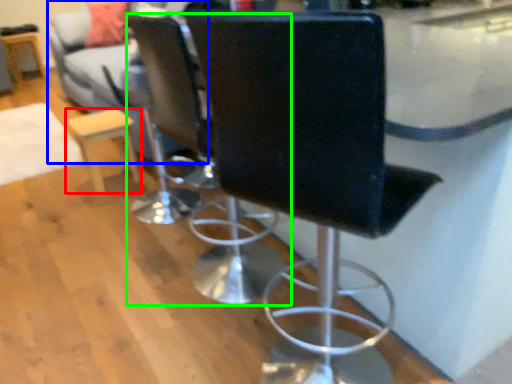
Question: Considering the real-world distances, which object is farthest from furniture (highlighted by a red box)? couch (highlighted by a blue box) or chair (highlighted by a green box)?

Choices:
 (A) couch
 (B) chair

Answer: (B)